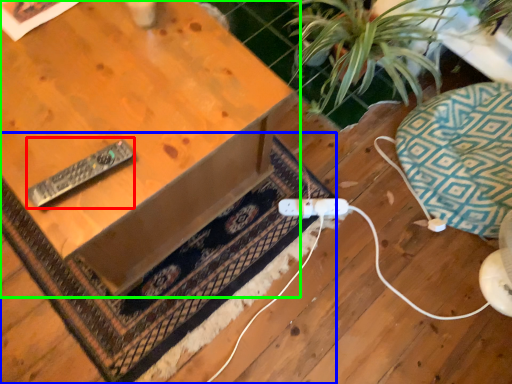
Question: Which object is positioned closest to remote (highlighted by a red box)? Select from doormat (highlighted by a blue box) and table (highlighted by a green box).

Choices:
 (A) doormat
 (B) table

Answer: (B)